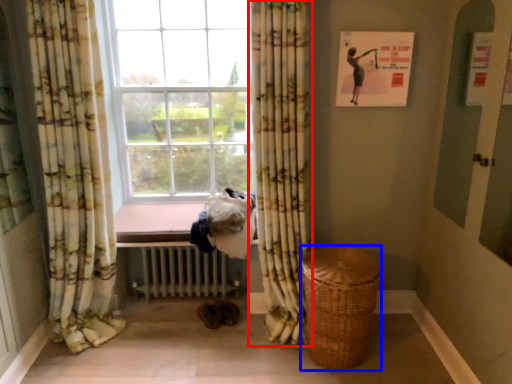
Question: Which point is closer to the camera, curtain (highlighted by a red box) or basket (highlighted by a blue box)?

Choices:
 (A) curtain
 (B) basket

Answer: (A)